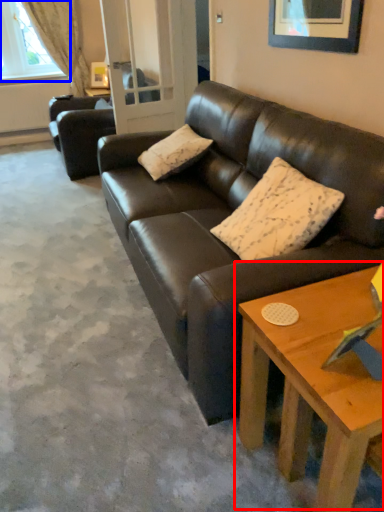
Question: Which object appears closest to the camera in this image, coffee table (highlighted by a red box) or window (highlighted by a blue box)?

Choices:
 (A) coffee table
 (B) window

Answer: (A)